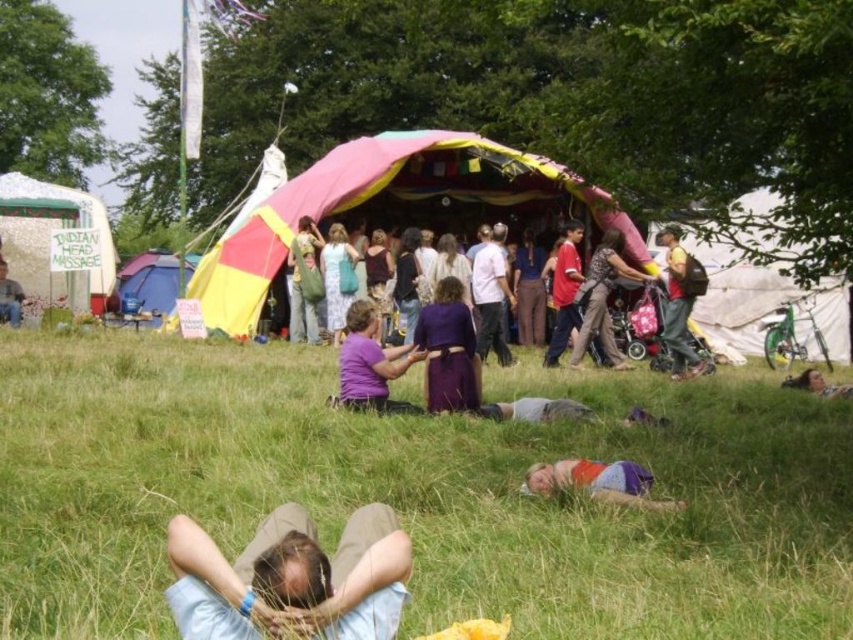
Question: Does purple matte shirt at center have a larger size compared to gray fabric pants at center?

Choices:
 (A) yes
 (B) no

Answer: (A)

Question: Which object is the closest to the green fabric bag at center?

Choices:
 (A) purple matte shirt at center
 (B) matte black shirt at center
 (C) matte yellow backpack at right

Answer: (B)

Question: Where is multicolored fabric at lower center located in relation to brown textured pants at center in the image?

Choices:
 (A) right
 (B) left

Answer: (B)

Question: Which point is closer to the camera?

Choices:
 (A) matte yellow backpack at right
 (B) green grass at lower center
 (C) light blue denim jeans at lower center
 (D) green fabric bag at center

Answer: (C)

Question: Is green grass at lower center closer to the viewer compared to white fabric tent at left?

Choices:
 (A) no
 (B) yes

Answer: (B)

Question: Which of the following is the closest to the observer?

Choices:
 (A) brown textured pants at center
 (B) purple fabric dress at center
 (C) gray fabric pants at center

Answer: (C)